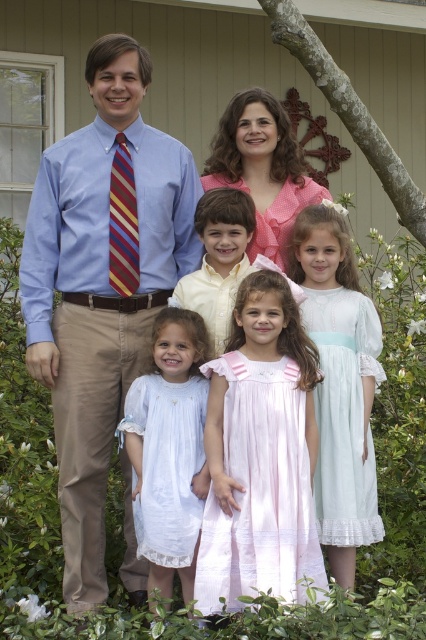
You are standing in front of the beige wooden house with the decorative wheel ornament. You see the matte blue shirt at center and the light blue sheer dress at center. Which one is closer to you?

The matte blue shirt at center is closer to you because it is further to the viewer than the light blue sheer dress at center.

You are a photographer taking a family portrait. You notice the matte blue shirt at center and the light blue sheer dress at center. Which clothing item is located to the left of the other?

The matte blue shirt at center is positioned on the left side of the light blue sheer dress at center.

You are a photographer trying to capture a group photo of the family. You need to ensure that the pink satin dress at center and the pink polka dot dress at center are both in focus. Given that your camera has a depth of field that can cover 5 feet, will both dresses be in focus?

The pink satin dress at center is 4.68 feet away from the pink polka dot dress at center. Since the distance between them is less than the camera lens depth of field of 5 feet, both dresses will be in focus.